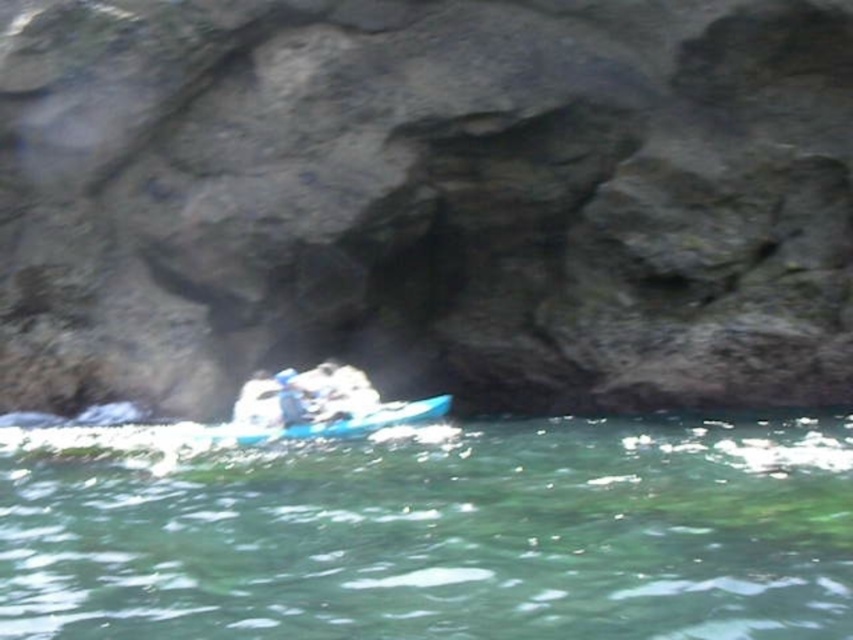
Question: Which of the following is the closest to the observer?

Choices:
 (A) blue plastic kayak at lower center
 (B) black rock at center
 (C) green translucent water at center

Answer: (C)

Question: Does green translucent water at center appear on the left side of blue plastic kayak at lower center?

Choices:
 (A) no
 (B) yes

Answer: (A)

Question: Estimate the real-world distances between objects in this image. Which object is closer to the blue plastic kayak at lower center?

Choices:
 (A) green translucent water at center
 (B) black rock at center

Answer: (A)

Question: Which object is the closest to the blue plastic kayak at lower center?

Choices:
 (A) green translucent water at center
 (B) black rock at center

Answer: (A)

Question: Does black rock at center appear over blue plastic kayak at lower center?

Choices:
 (A) yes
 (B) no

Answer: (A)

Question: Can you confirm if black rock at center is smaller than blue plastic kayak at lower center?

Choices:
 (A) no
 (B) yes

Answer: (A)